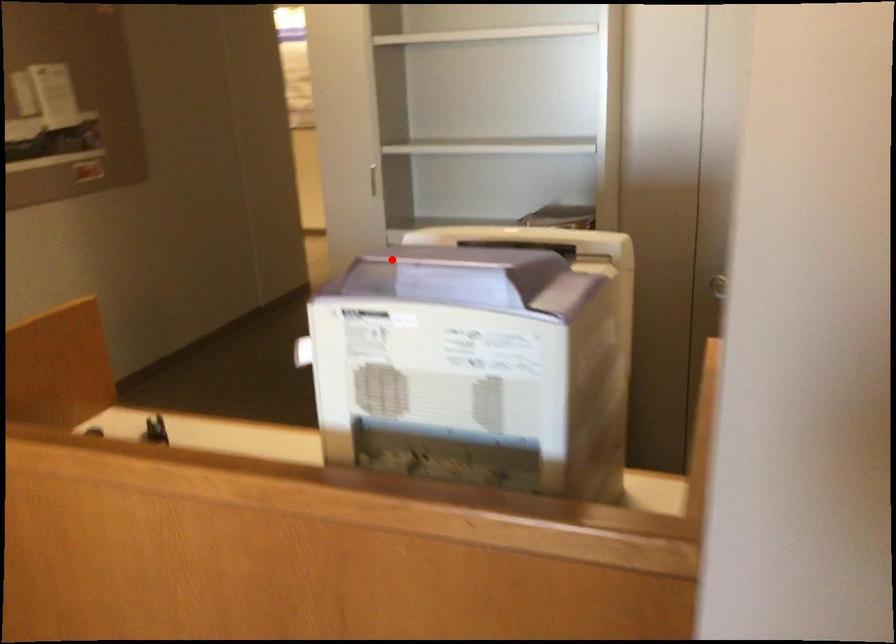
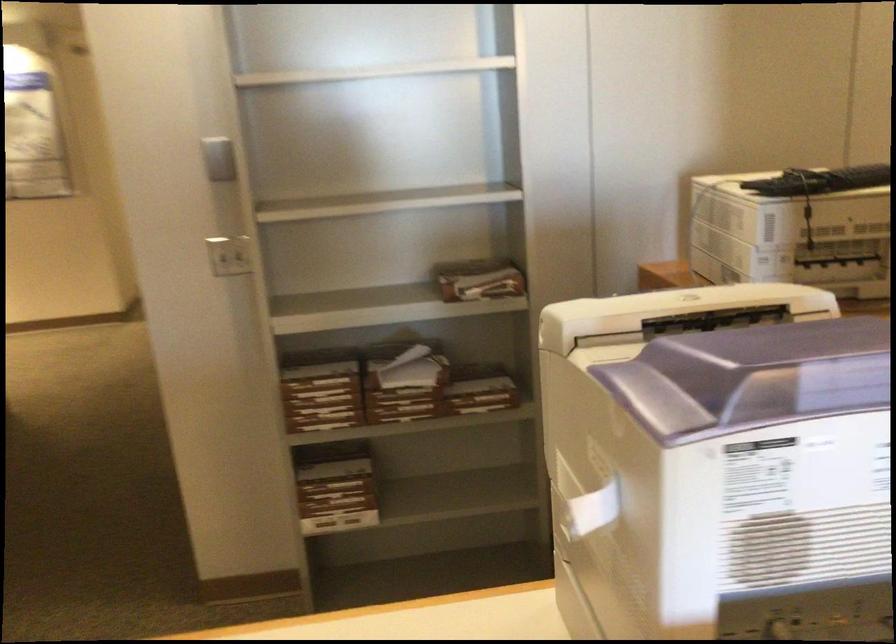
The point at the highlighted location is marked in the first image. Where is the corresponding point in the second image?

(780, 368)